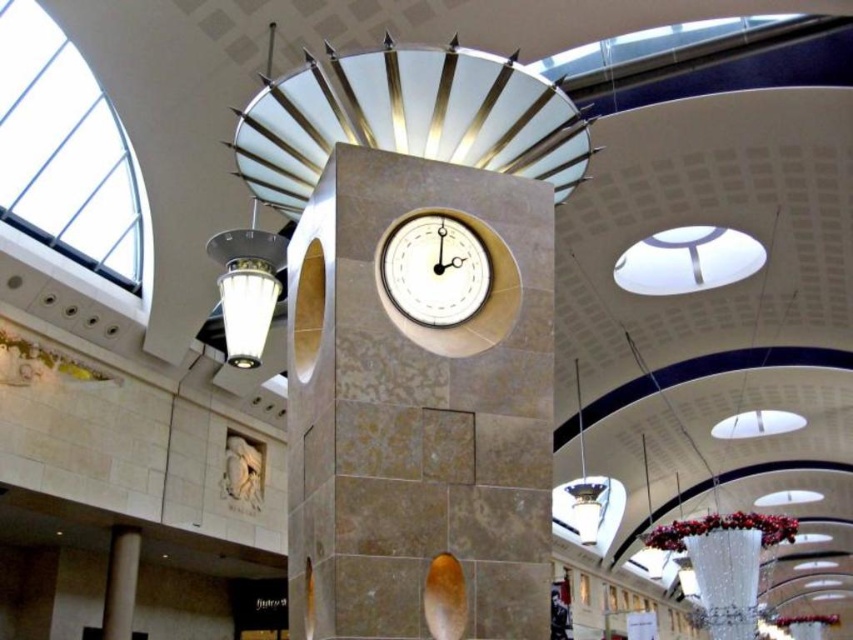
Question: Which object is farther from the camera taking this photo?

Choices:
 (A) white stone sculpture at center
 (B) matte stone clock at center
 (C) white glossy clock at center

Answer: (A)

Question: Which object appears closest to the camera in this image?

Choices:
 (A) smooth beige pillar at lower left
 (B) matte stone clock at center
 (C) white stone sculpture at center

Answer: (B)

Question: Can you confirm if matte stone clock at center is positioned below white stone sculpture at center?

Choices:
 (A) no
 (B) yes

Answer: (A)

Question: Can you confirm if matte stone clock at center is wider than white stone sculpture at center?

Choices:
 (A) yes
 (B) no

Answer: (A)

Question: Does smooth beige pillar at lower left come in front of white stone sculpture at center?

Choices:
 (A) no
 (B) yes

Answer: (B)

Question: Estimate the real-world distances between objects in this image. Which object is closer to the matte stone clock at center?

Choices:
 (A) white glossy clock at center
 (B) smooth beige pillar at lower left
 (C) white stone sculpture at center

Answer: (A)